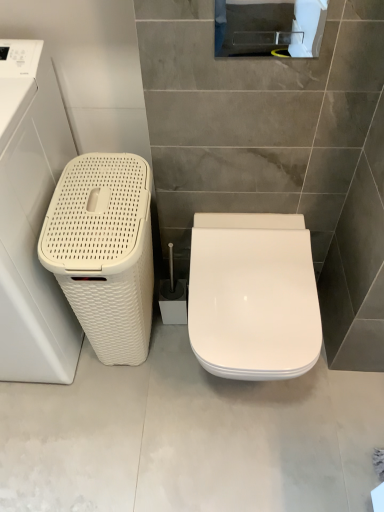
The image size is (384, 512). What are the coordinates of `free space above white glossy toilet seat at center (from a real-world perspective)` in the screenshot? It's located at (253, 266).